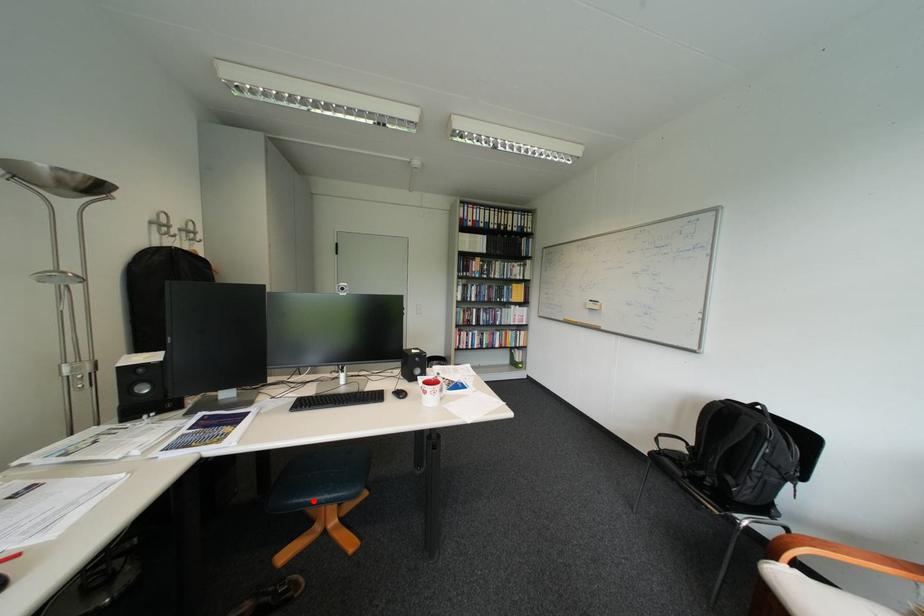
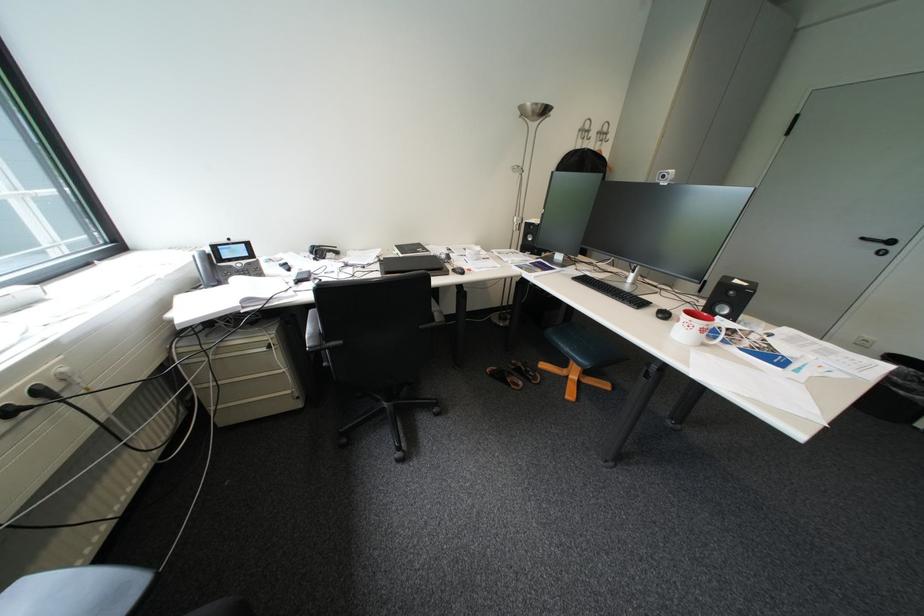
Where in the second image is the point corresponding to the highlighted location from the first image?

(569, 341)